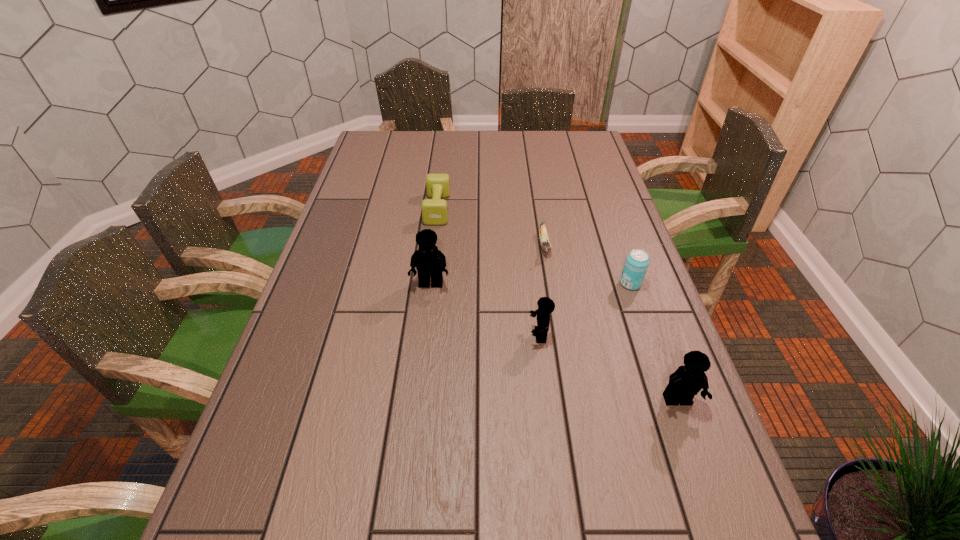
You are a GUI agent. You are given a task and a screenshot of the screen. Output one action in this format:
    pyautogui.click(x=<x>, y=<y>)
    Task: Click on the free space for a new Lego on the left
    This screenshot has width=960, height=540.
    Given the screenshot: What is the action you would take?
    pos(343,243)